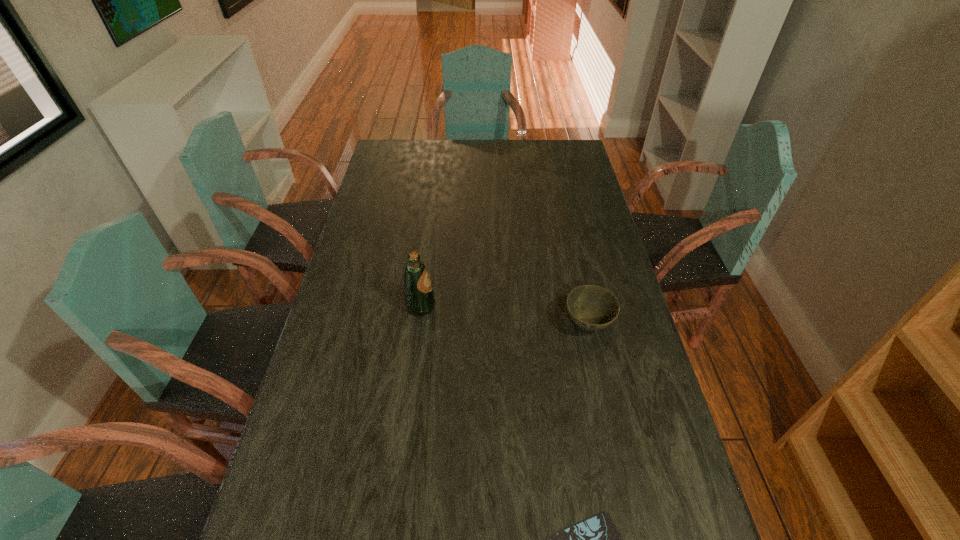
You are a GUI agent. You are given a task and a screenshot of the screen. Output one action in this format:
    pyautogui.click(x=<x>, y=<y>)
    Task: Click on the tallest object
    This screenshot has height=540, width=960.
    Given the screenshot: What is the action you would take?
    pyautogui.click(x=419, y=298)

Locate an element on the screen. This screenshot has width=960, height=540. the leftmost object is located at coordinates (419, 298).

Find the location of a particular element. the second shortest object is located at coordinates (591, 307).

Where is `free space located 0.220m on the front-facing side of the olive oil`? The height and width of the screenshot is (540, 960). free space located 0.220m on the front-facing side of the olive oil is located at coordinates click(508, 307).

Image resolution: width=960 pixels, height=540 pixels. Identify the location of blank space located on the front of the bowl. (623, 485).

Image resolution: width=960 pixels, height=540 pixels. Find the location of `object at the right edge`. object at the right edge is located at coordinates (591, 307).

This screenshot has height=540, width=960. Find the location of `free space at the far edge of the desktop`. free space at the far edge of the desktop is located at coordinates (456, 160).

The width and height of the screenshot is (960, 540). I want to click on free point at the left edge, so click(x=360, y=225).

This screenshot has width=960, height=540. Identify the location of vacant region at the right edge. (583, 254).

The height and width of the screenshot is (540, 960). In the image, there is a desktop. What are the coordinates of `vacant space at the far left corner` in the screenshot? It's located at (386, 165).